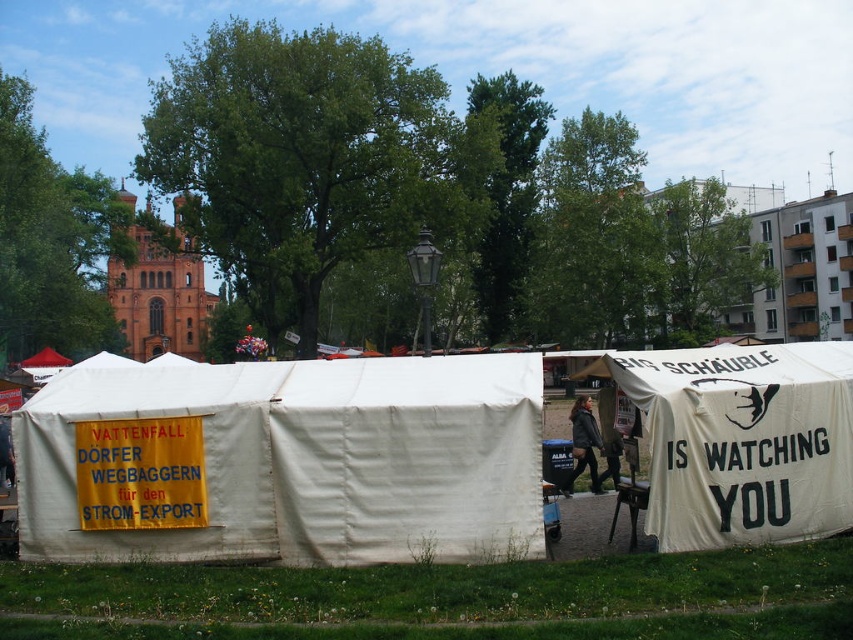
In the scene shown: Does white canvas tent at right have a greater width compared to dark gray leather jacket at center?

Yes, white canvas tent at right is wider than dark gray leather jacket at center.

From the picture: Is white canvas tent at right positioned behind dark gray leather jacket at center?

No, white canvas tent at right is closer to the viewer.

Which is behind, point (763, 513) or point (573, 440)?

Point (573, 440)

Find the location of `white canvas tent at right`. white canvas tent at right is located at coordinates click(741, 440).

Can you confirm if white canvas tent at center is taller than white canvas tent at right?

Yes, white canvas tent at center is taller than white canvas tent at right.

Is the position of white canvas tent at center more distant than that of white canvas tent at right?

No, it is not.

Is point (67, 392) closer to camera compared to point (705, 525)?

No.

At what (x,y) coordinates should I click in order to perform the action: click on white canvas tent at center. Please return your answer as a coordinate pair (x, y). The width and height of the screenshot is (853, 640). Looking at the image, I should click on (283, 461).

Is white canvas tent at center positioned at the back of dark gray leather jacket at center?

No, white canvas tent at center is closer to the viewer.

Is white canvas tent at center shorter than dark gray leather jacket at center?

No.

Is point (410, 541) positioned behind point (602, 490)?

That is False.

Where is `white canvas tent at center`? The width and height of the screenshot is (853, 640). white canvas tent at center is located at coordinates (283, 461).